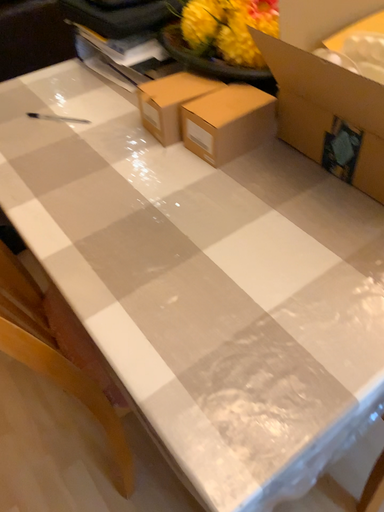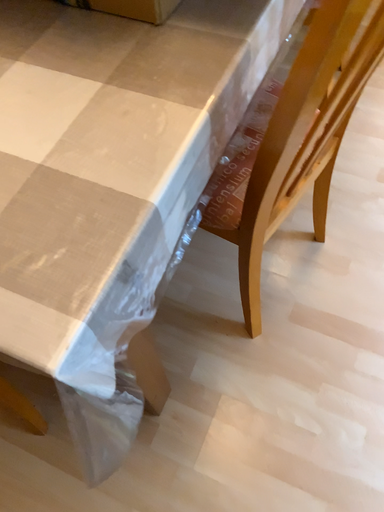
Question: Which way did the camera rotate in the video?

Choices:
 (A) rotated right
 (B) rotated left

Answer: (A)